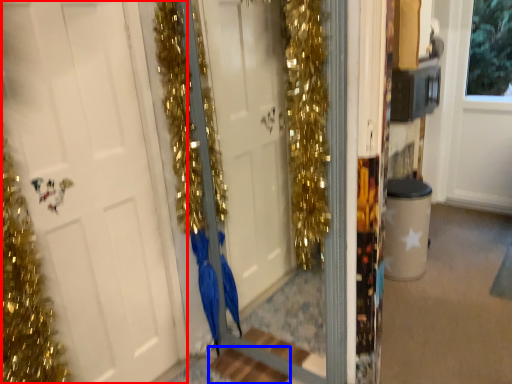
Question: Which point is closer to the camera, door (highlighted by a red box) or stair (highlighted by a blue box)?

Choices:
 (A) door
 (B) stair

Answer: (A)